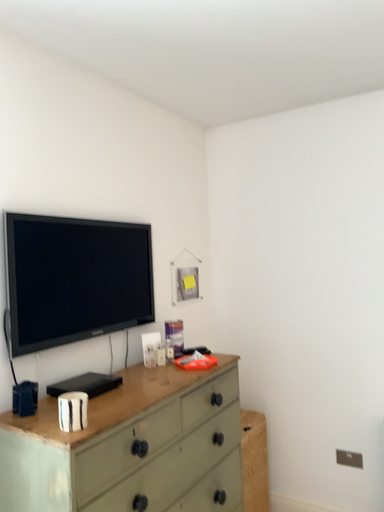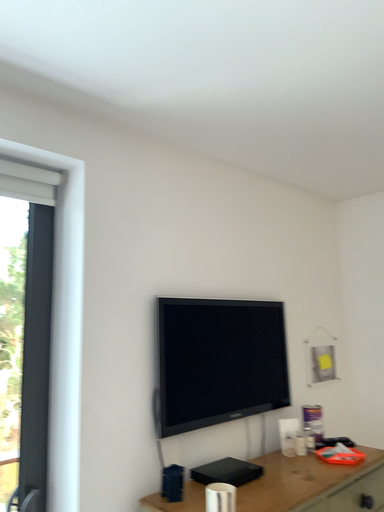
Question: Which way did the camera rotate in the video?

Choices:
 (A) rotated upward
 (B) rotated downward

Answer: (A)